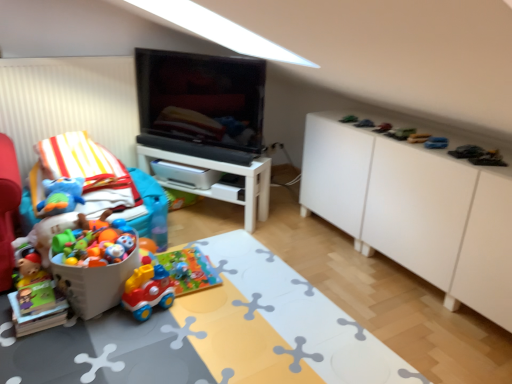
Identify the location of free space to the right of wooden toy train at lower left, the 2th toy in the left-to-right sequence. This screenshot has width=512, height=384. pos(87,326).